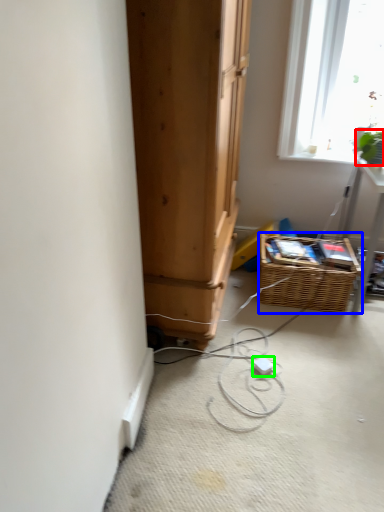
Question: Which object is the farthest from plant (highlighted by a red box)? Choose among these: basket (highlighted by a blue box) or extension cord (highlighted by a green box).

Choices:
 (A) basket
 (B) extension cord

Answer: (B)